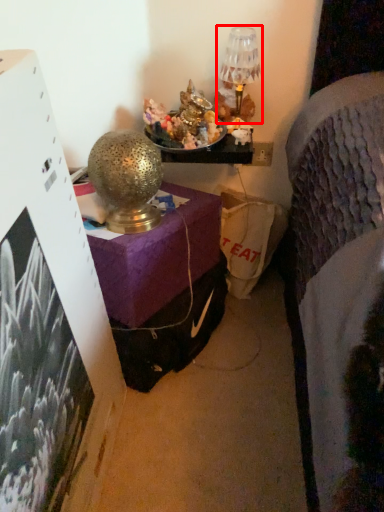
Question: Observing the image, what is the correct spatial positioning of table lamp (annotated by the red box) in reference to table lamp?

Choices:
 (A) left
 (B) right

Answer: (B)